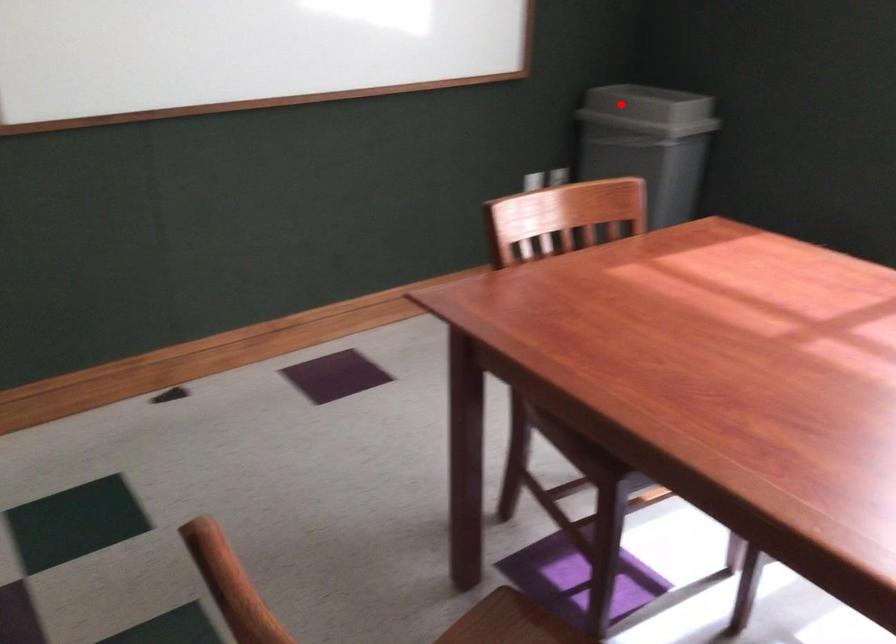
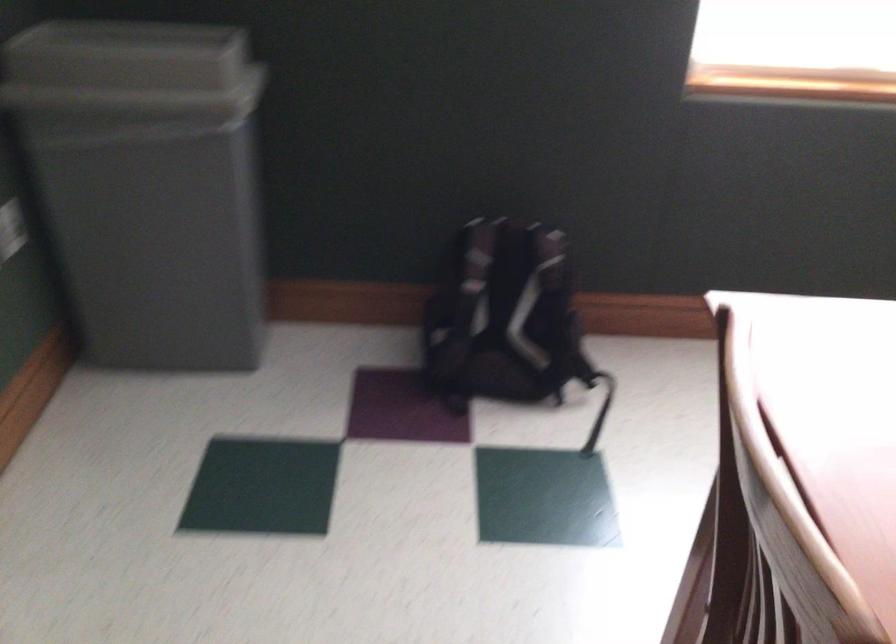
Question: I am providing you with two images of the same scene from different viewpoints. Image1 has a red point marked. In image2, the corresponding 3D location appears at what relative position? Reply with the corresponding letter.

Choices:
 (A) Closer
 (B) Farther

Answer: (A)